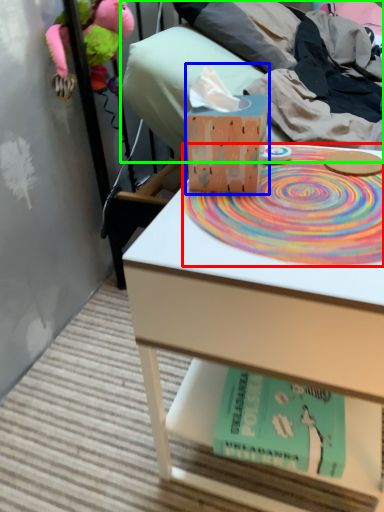
Question: Based on their relative distances, which object is farther from mat (highlighted by a red box)? Choose from tissue (highlighted by a blue box) and bed (highlighted by a green box).

Choices:
 (A) tissue
 (B) bed

Answer: (B)